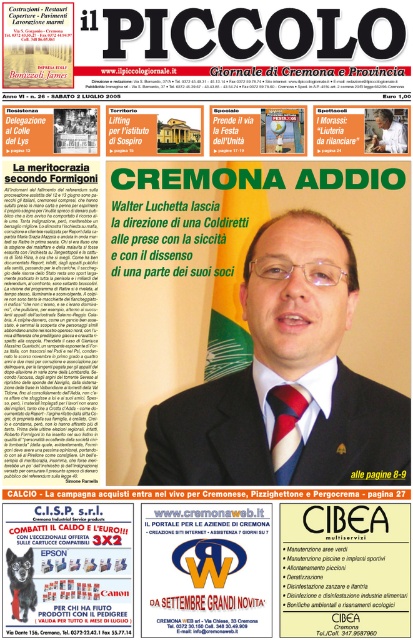
You are a fashion critic reviewing the front page of il PICCOLO newspaper. You notice the matte black suit at center and the brown leather wallet at center. Which object is positioned closer to the viewer?

The matte black suit at center is closer to the viewer than the brown leather wallet at center.

You are a fashion journalist reviewing the front page of il PICCOLO. You notice the matte black suit at center and the red silk tie at center. Which one is positioned to the left?

The matte black suit at center is to the left of the red silk tie at center.